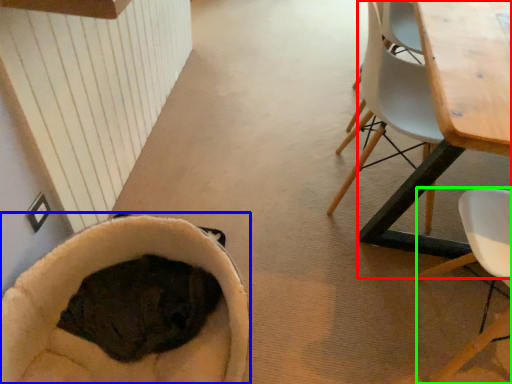
Question: Which object is positioned closest to table (highlighted by a red box)? Select from bean bag chair (highlighted by a blue box) and chair (highlighted by a green box).

Choices:
 (A) bean bag chair
 (B) chair

Answer: (B)